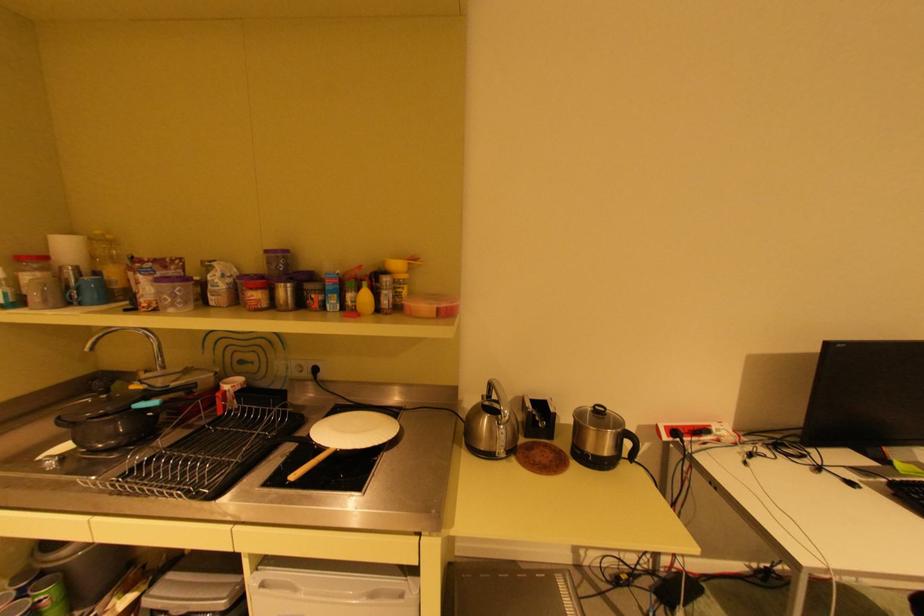
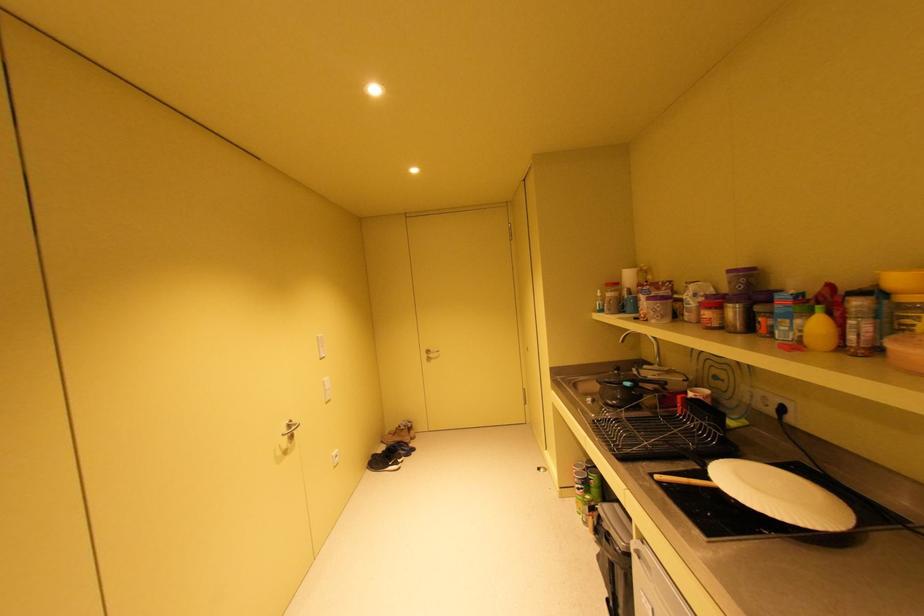
Locate, in the second image, the point that corresponds to point 337,448 in the first image.

(721, 482)